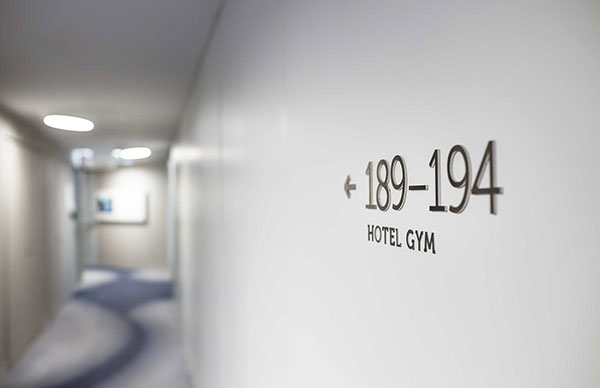
This screenshot has height=388, width=600. I want to click on blurry white tile floor, so click(x=154, y=362).